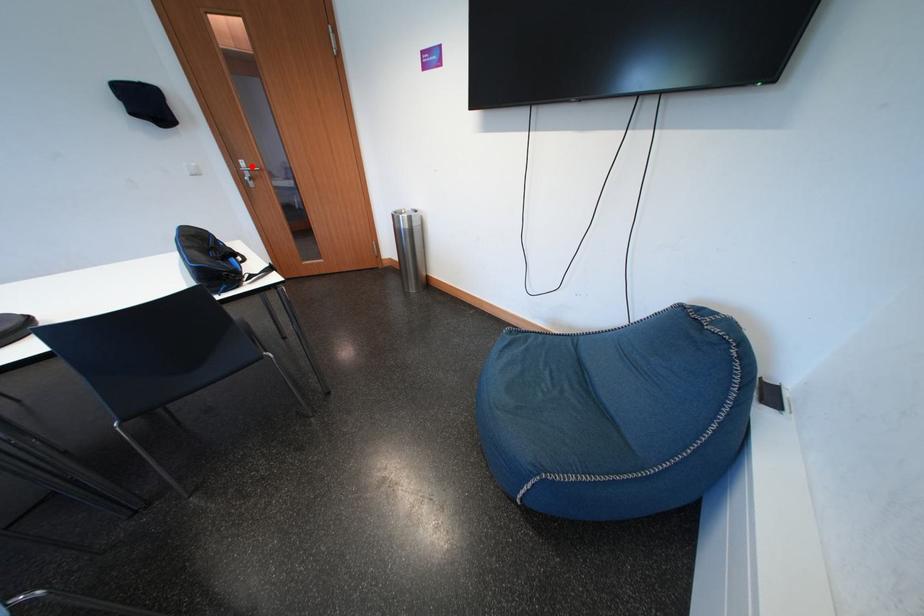
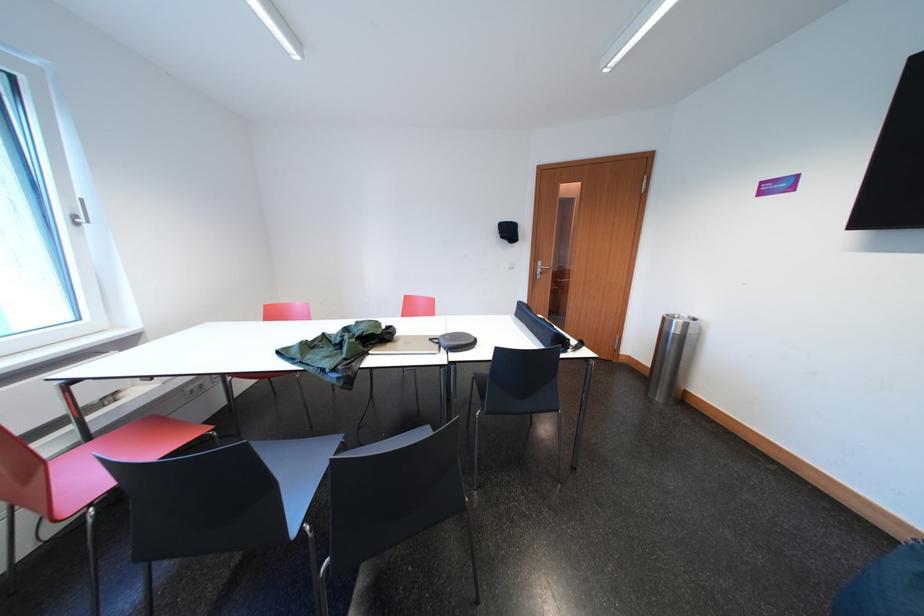
Question: A red point is marked in image1. In image2, is the corresponding 3D point closer to the camera or farther? Reply with the corresponding letter.

Choices:
 (A) The corresponding 3D point is closer.
 (B) The corresponding 3D point is farther.

Answer: (A)